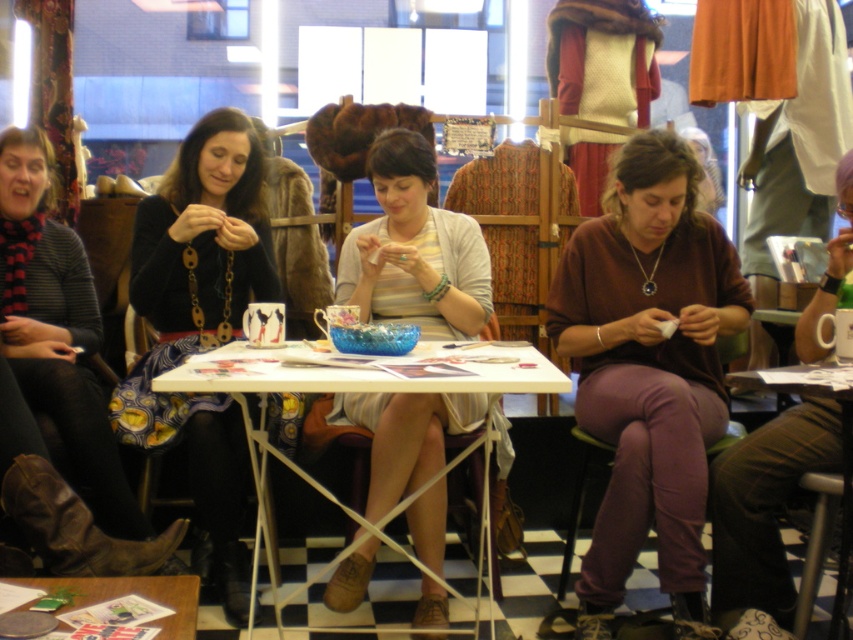
Which of these two, matte black sweater at center or black knit sweater at left, stands shorter?

With less height is black knit sweater at left.

Can you confirm if matte black sweater at center is shorter than black knit sweater at left?

Incorrect, matte black sweater at center's height does not fall short of black knit sweater at left's.

Where is `matte black sweater at center`? The width and height of the screenshot is (853, 640). matte black sweater at center is located at coordinates pos(200,321).

Locate an element on the screen. The image size is (853, 640). matte black sweater at center is located at coordinates (200, 321).

Is matte black sweater at center to the right of wooden table at lower left from the viewer's perspective?

No, matte black sweater at center is not to the right of wooden table at lower left.

Is point (231, 502) in front of point (184, 630)?

No, it is behind (184, 630).

Where is `matte black sweater at center`? This screenshot has height=640, width=853. matte black sweater at center is located at coordinates (200, 321).

Who is lower down, striped cotton shirt at center or black knit sweater at left?

black knit sweater at left is below.

Who is more forward, (399, 416) or (13, 225)?

Point (399, 416) is in front.

Which is behind, point (363, 257) or point (44, 316)?

The point (44, 316) is behind.

Identify the location of striped cotton shirt at center. This screenshot has width=853, height=640. (415, 248).